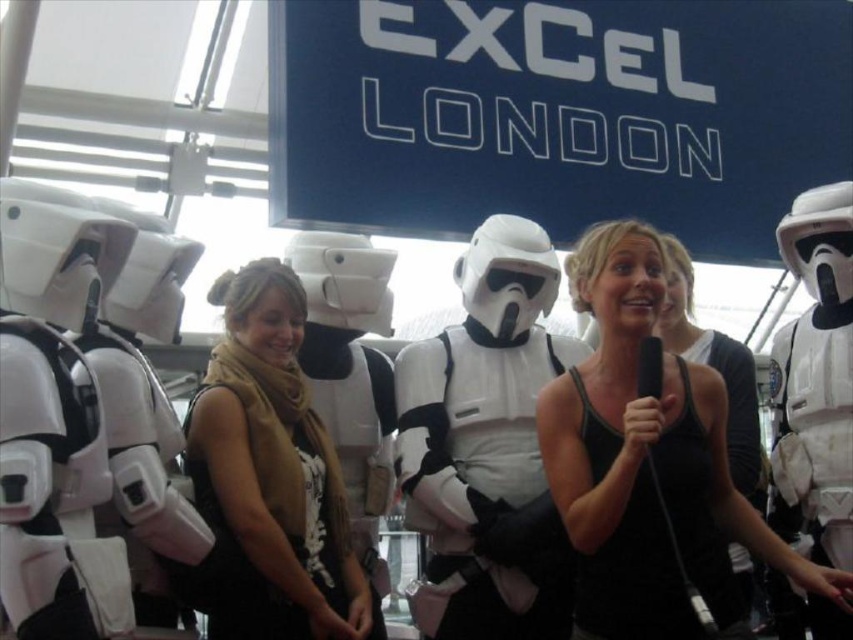
Which is more to the left, black tank top at center or tan scarf at center?

Positioned to the left is tan scarf at center.

Can you confirm if black tank top at center is positioned above tan scarf at center?

Correct, black tank top at center is located above tan scarf at center.

This screenshot has height=640, width=853. Find the location of `black tank top at center`. black tank top at center is located at coordinates (645, 464).

This screenshot has width=853, height=640. In order to click on black tank top at center in this screenshot , I will do `click(645, 464)`.

Can you confirm if tan scarf at center is thinner than black matte tank top at center?

In fact, tan scarf at center might be wider than black matte tank top at center.

Which is more to the right, tan scarf at center or black matte tank top at center?

black matte tank top at center is more to the right.

Find the location of a particular element. tan scarf at center is located at coordinates (270, 477).

Does point (450, 440) come in front of point (579, 433)?

No.

Does white matte stormtrooper armor at center appear over black matte tank top at center?

Indeed, white matte stormtrooper armor at center is positioned over black matte tank top at center.

The height and width of the screenshot is (640, 853). What do you see at coordinates (483, 481) in the screenshot?
I see `white matte stormtrooper armor at center` at bounding box center [483, 481].

Identify the location of white matte stormtrooper armor at center. (483, 481).